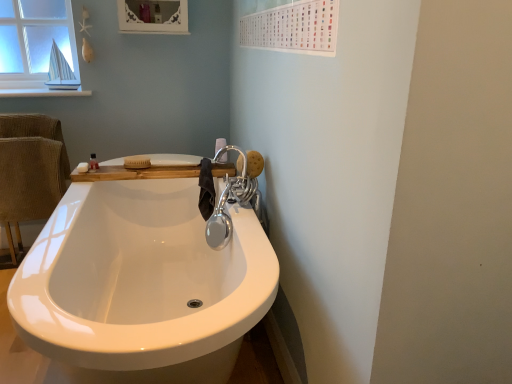
Question: In the image, is shiny metallic faucet at upper right on the left side or the right side of woodenmaterial/texturecounter top at upper center?

Choices:
 (A) left
 (B) right

Answer: (B)

Question: Considering the positions of point (241, 201) and point (218, 173), is point (241, 201) closer or farther from the camera than point (218, 173)?

Choices:
 (A) closer
 (B) farther

Answer: (A)

Question: Estimate the real-world distances between objects in this image. Which object is farther from the white matte soap at upper left?

Choices:
 (A) woodenmaterial/texturecounter top at upper center
 (B) shiny metallic faucet at upper right
 (C) white glossy toilet paper at upper center
 (D) beige corduroy armchair at left
 (E) matte white medicine cabinet at upper center

Answer: (E)

Question: Considering the real-world distances, which object is closest to the shiny metallic faucet at upper right?

Choices:
 (A) woodenmaterial/texturecounter top at upper center
 (B) white matte soap at upper left
 (C) beige corduroy armchair at left
 (D) white glossy toilet paper at upper center
 (E) matte white medicine cabinet at upper center

Answer: (A)